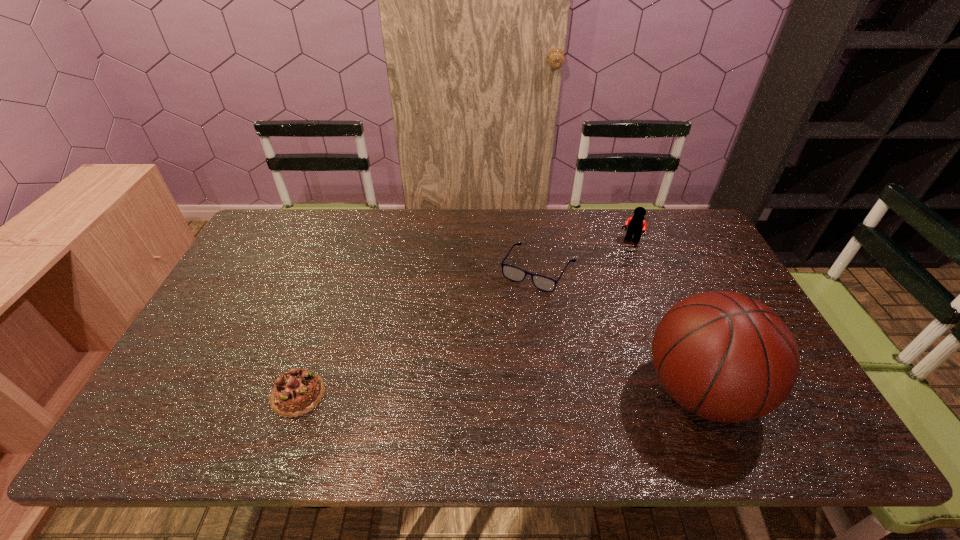
Where is `free space located 0.240m on the front-facing side of the third shortest object`? free space located 0.240m on the front-facing side of the third shortest object is located at coordinates (597, 288).

At what (x,y) coordinates should I click in order to perform the action: click on free point located 0.270m on the front-facing side of the third shortest object. Please return your answer as a coordinate pair (x, y). This screenshot has width=960, height=540. Looking at the image, I should click on (592, 294).

Find the location of a particular element. The width and height of the screenshot is (960, 540). spectacles present at the far edge is located at coordinates (513, 273).

Identify the location of Lego that is at the far edge. (636, 224).

I want to click on chocolate cake that is at the near edge, so click(298, 391).

The width and height of the screenshot is (960, 540). I want to click on basketball present at the near edge, so click(728, 358).

The height and width of the screenshot is (540, 960). Find the location of `object present at the right edge`. object present at the right edge is located at coordinates (728, 358).

Identify the location of object at the near right corner. (728, 358).

In the image, there is a desktop. Where is `vacant space at the far edge`? This screenshot has width=960, height=540. vacant space at the far edge is located at coordinates (658, 239).

Locate an element on the screen. The image size is (960, 540). blank space at the left edge of the desktop is located at coordinates (202, 335).